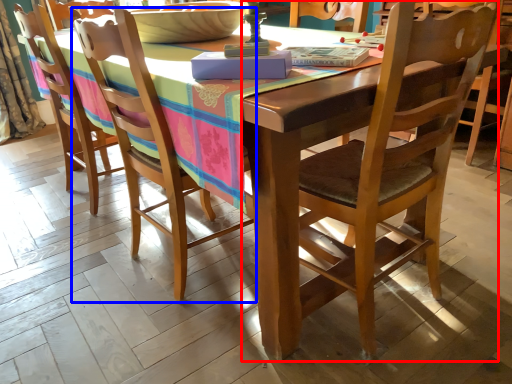
Question: Which point is further to the camera, chair (highlighted by a red box) or chair (highlighted by a blue box)?

Choices:
 (A) chair
 (B) chair

Answer: (B)